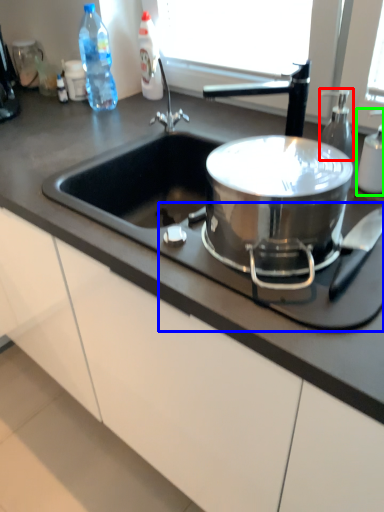
Question: Which is farther away from soap dispenser (highlighted by a red box)? gas stove (highlighted by a blue box) or bottle (highlighted by a green box)?

Choices:
 (A) gas stove
 (B) bottle

Answer: (A)